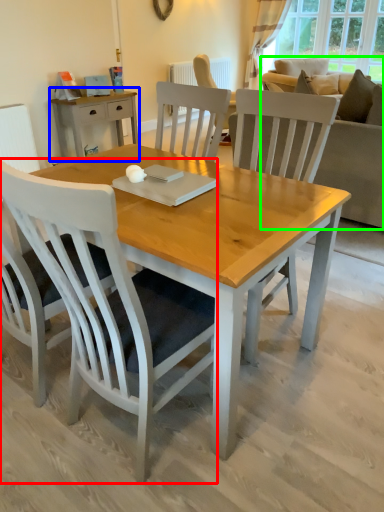
Question: Which object is positioned closest to chair (highlighted by a red box)? Select from desk (highlighted by a blue box) and studio couch (highlighted by a green box).

Choices:
 (A) desk
 (B) studio couch

Answer: (B)